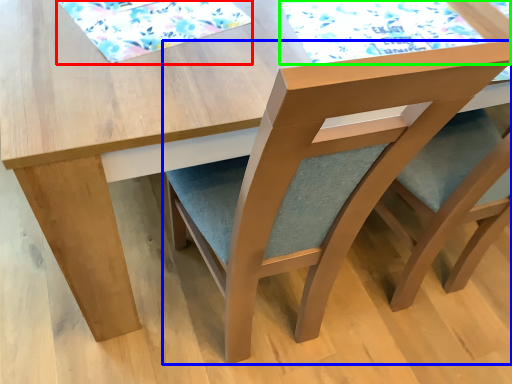
Question: Considering the real-world distances, which object is farthest from mat (highlighted by a red box)? chair (highlighted by a blue box) or mat (highlighted by a green box)?

Choices:
 (A) chair
 (B) mat

Answer: (A)